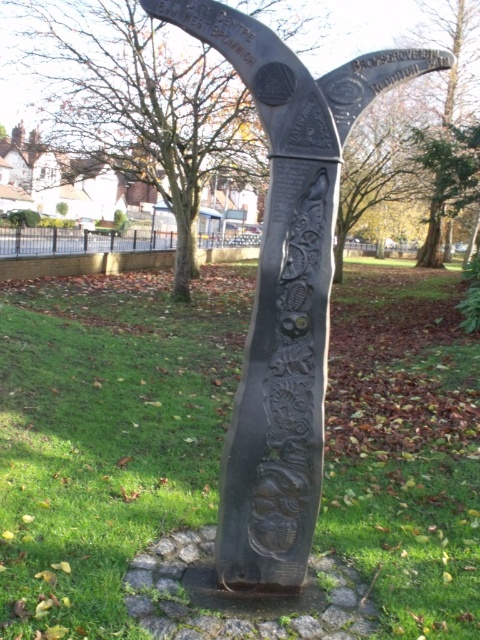
Identify the location of green grass at center. The height and width of the screenshot is (640, 480). (108, 429).

Can you confirm if green grass at center is positioned above black polished stone sculpture at center?

No, green grass at center is not above black polished stone sculpture at center.

Between point (215, 412) and point (311, 122), which one is positioned behind?

The point (215, 412) is behind.

What are the coordinates of `green grass at center` in the screenshot? It's located at (108, 429).